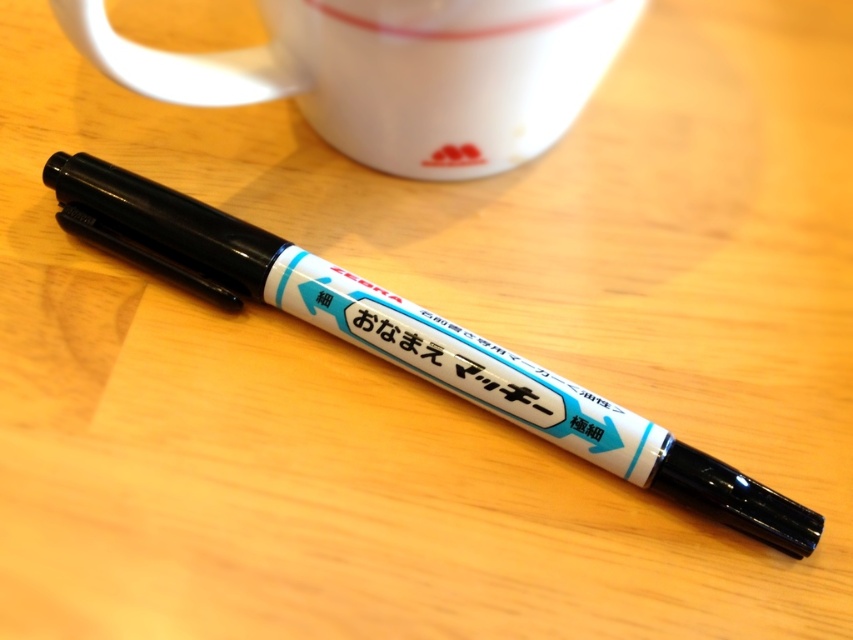
Question: Is white matte mug at upper center thinner than black plastic marker at center?

Choices:
 (A) no
 (B) yes

Answer: (B)

Question: Can you confirm if white matte mug at upper center is positioned below black plastic marker at center?

Choices:
 (A) yes
 (B) no

Answer: (B)

Question: Which object is closer to the camera taking this photo?

Choices:
 (A) black plastic marker at center
 (B) white matte mug at upper center

Answer: (B)

Question: Which of the following is the closest to the observer?

Choices:
 (A) black plastic marker at center
 (B) white matte mug at upper center

Answer: (B)

Question: Which object is closer to the camera taking this photo?

Choices:
 (A) black plastic marker at center
 (B) white matte mug at upper center

Answer: (B)

Question: Can you confirm if white matte mug at upper center is wider than black plastic marker at center?

Choices:
 (A) no
 (B) yes

Answer: (A)